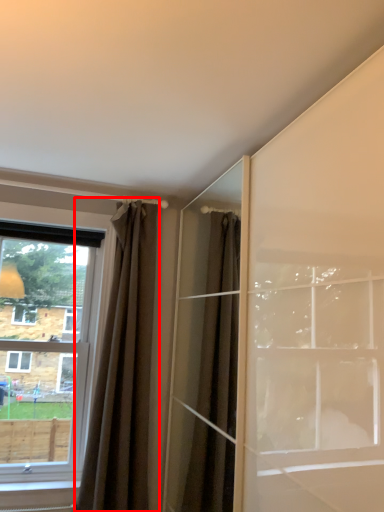
Question: From the image's perspective, where is curtain (annotated by the red box) located relative to window?

Choices:
 (A) above
 (B) below

Answer: (B)